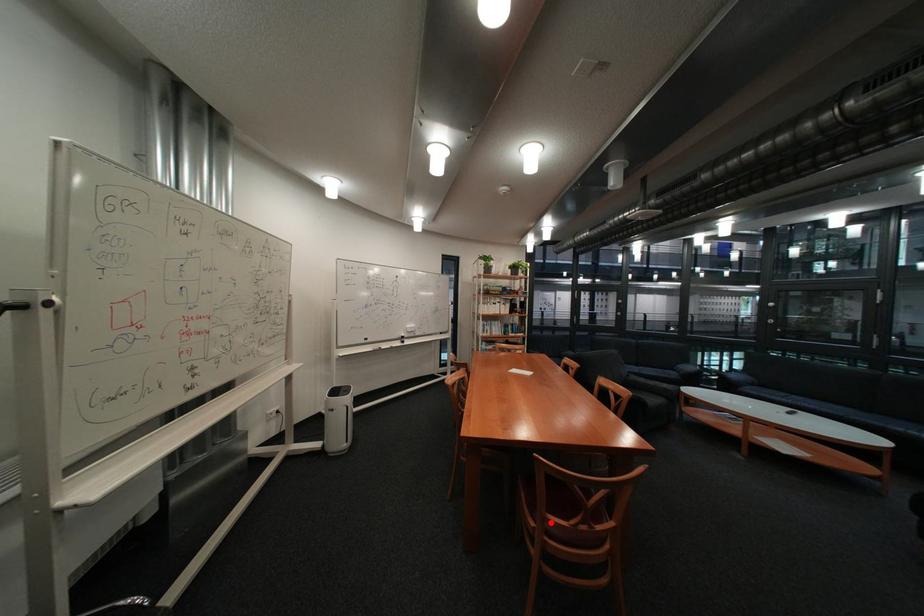
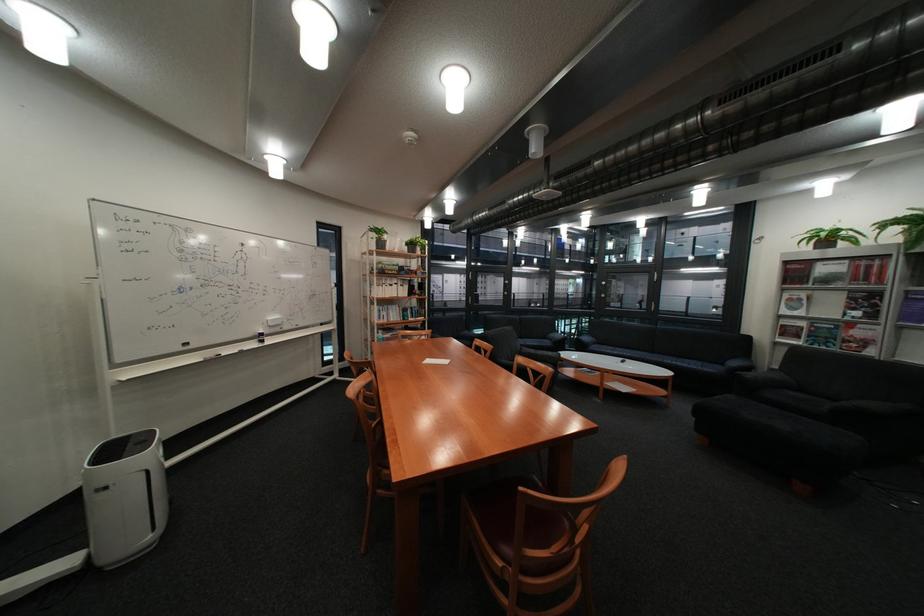
Question: I am providing you with two images of the same scene from different viewpoints. Given a red point in image1, look at the same physical point in image2. Is it:

Choices:
 (A) Closer to the viewpoint
 (B) Farther from the viewpoint

Answer: (B)